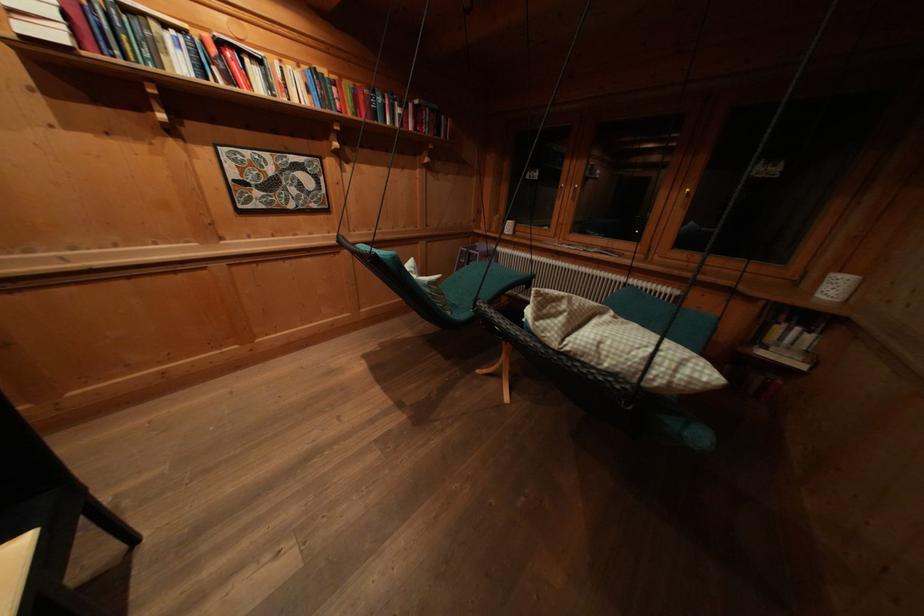
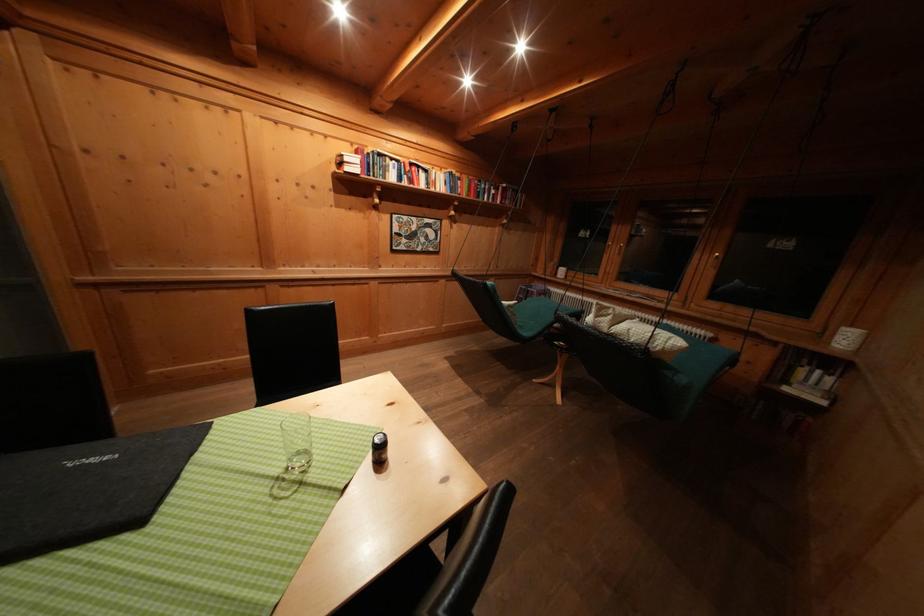
In the second image, find the point that corresponds to the point at 225,47 in the first image.

(418, 169)